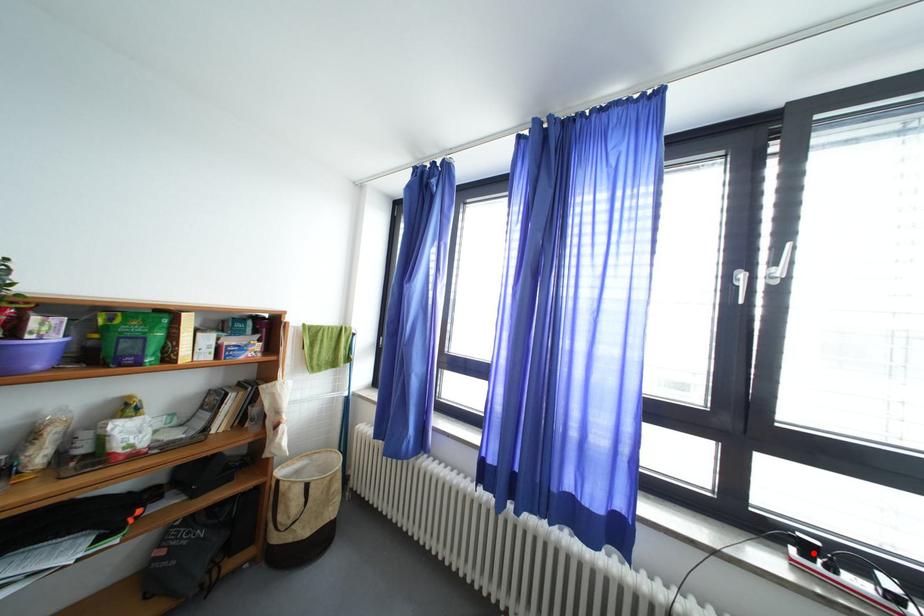
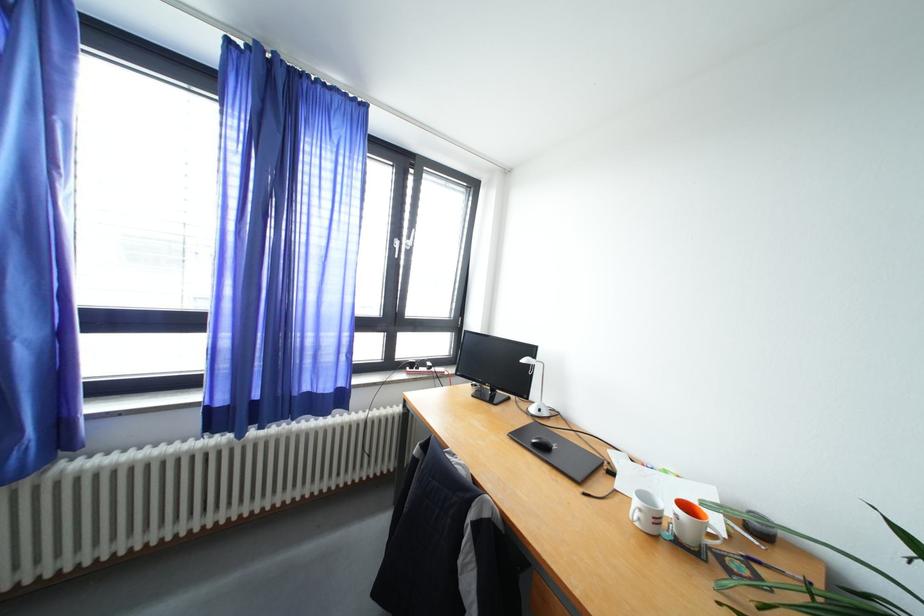
Locate, in the second image, the point that corresponds to the highlighted location in the first image.

(419, 370)